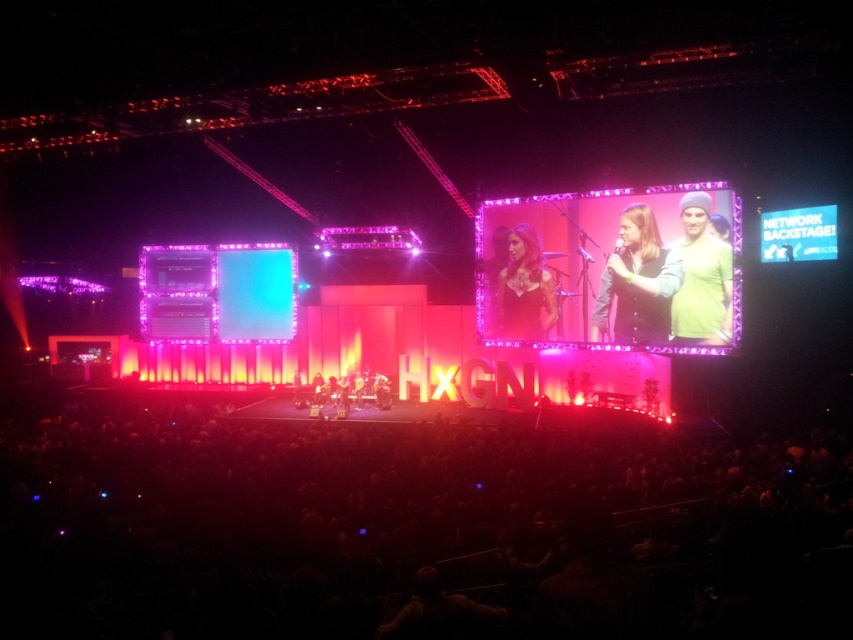
Which is behind, point (517, 256) or point (720, 308)?

Point (517, 256)

Locate an element on the screen. The height and width of the screenshot is (640, 853). matte black dress at center is located at coordinates (525, 289).

In order to click on matte black dress at center in this screenshot , I will do `click(525, 289)`.

Is green fabric jacket at upper right positioned in front of green knit beanie at upper right?

No, it is not.

Is green fabric jacket at upper right to the left of green knit beanie at upper right from the viewer's perspective?

Correct, you'll find green fabric jacket at upper right to the left of green knit beanie at upper right.

Does point (608, 280) come behind point (693, 234)?

Yes, point (608, 280) is farther from viewer.

You are a GUI agent. You are given a task and a screenshot of the screen. Output one action in this format:
    pyautogui.click(x=<x>, y=<y>)
    Task: Click on the green fabric jacket at upper right
    
    Given the screenshot: What is the action you would take?
    coord(637,282)

From the picture: Can you confirm if green fabric jacket at upper right is taller than matte black dress at center?

No, green fabric jacket at upper right is not taller than matte black dress at center.

Who is more distant from viewer, (643,276) or (549,278)?

Point (549,278)

I want to click on green fabric jacket at upper right, so click(637, 282).